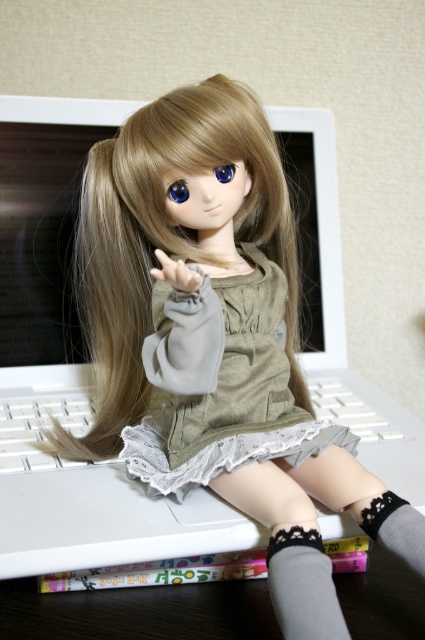
You are organizing a small party and need to place a decorative centerpiece on the table. Given the placement of the dark wood table at lower center and the gray knitted sock at lower right, where should you place the centerpiece to ensure it is centered between them?

The dark wood table at lower center is positioned on the left side of the gray knitted sock at lower right, so the centerpiece should be placed between them, closer to the middle of the table to ensure it is centered between both objects.

You are trying to determine if the brown silky hair at center can cover the gray lace sock at lower center completely. Based on their sizes, can it?

The brown silky hair at center has a larger width than the gray lace sock at lower center, so it can potentially cover the sock completely if positioned correctly.

You are a person sitting at a desk and you see the dark wood table at lower center and the gray knitted sock at lower right. Which object is closer to you?

The dark wood table at lower center is closer to you because the gray knitted sock at lower right is behind it.